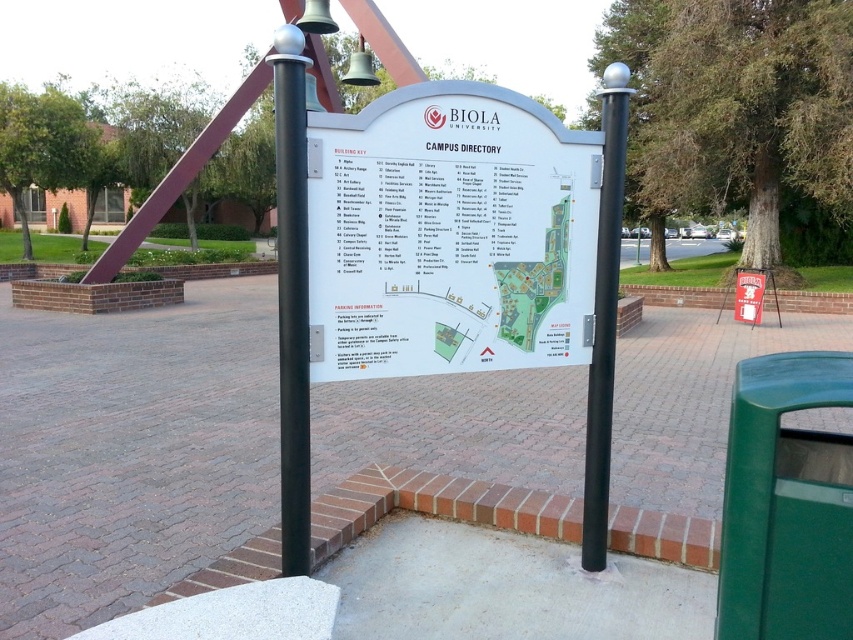
Looking at this image, is white plastic sign at center smaller than black polished metal pole at center?

Actually, white plastic sign at center might be larger than black polished metal pole at center.

Does white plastic sign at center have a greater width compared to black polished metal pole at center?

Indeed, white plastic sign at center has a greater width compared to black polished metal pole at center.

Is point (564, 243) farther from camera compared to point (297, 144)?

Yes, it is behind point (297, 144).

Where is `white plastic sign at center`? white plastic sign at center is located at coordinates (450, 234).

Does white plastic sign at center have a smaller size compared to black metal pole at right?

Incorrect, white plastic sign at center is not smaller in size than black metal pole at right.

Based on the photo, is the position of white plastic sign at center more distant than that of black metal pole at right?

No, it is in front of black metal pole at right.

Is point (596, 163) positioned behind point (614, 108)?

Yes, point (596, 163) is behind point (614, 108).

Identify the location of white plastic sign at center. (450, 234).

The height and width of the screenshot is (640, 853). What do you see at coordinates (292, 296) in the screenshot?
I see `black polished metal pole at center` at bounding box center [292, 296].

Based on the photo, can you confirm if black polished metal pole at center is positioned above black metal pole at right?

No, black polished metal pole at center is not above black metal pole at right.

Locate an element on the screen. The height and width of the screenshot is (640, 853). black polished metal pole at center is located at coordinates (292, 296).